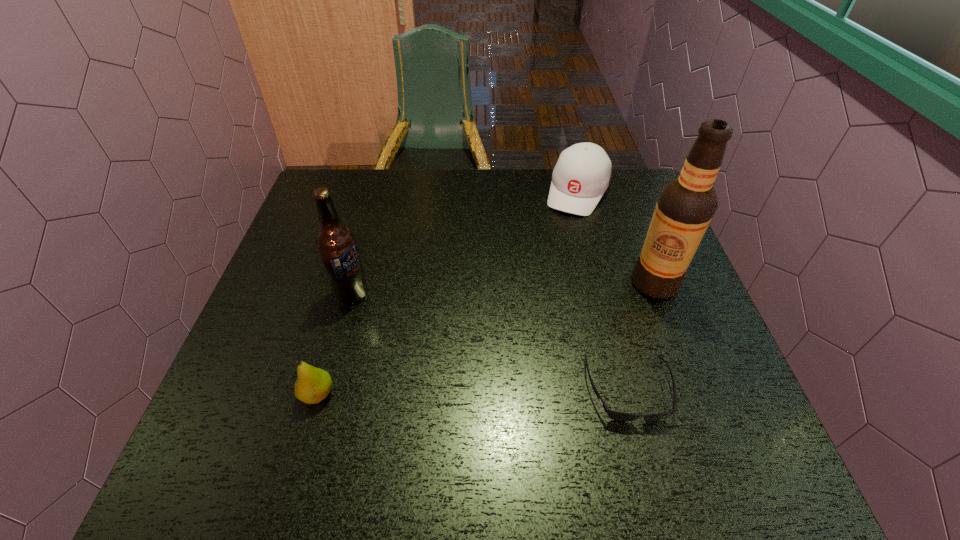
I want to click on pear, so click(313, 384).

Identify the location of sunglasses. (614, 415).

Locate an element on the screen. The width and height of the screenshot is (960, 540). the farthest object is located at coordinates (582, 174).

Where is `the tallest object`? the tallest object is located at coordinates (686, 205).

The height and width of the screenshot is (540, 960). Identify the location of beer bottle. (336, 243).

I want to click on vacant space situated on the back of the pear, so click(x=337, y=329).

Image resolution: width=960 pixels, height=540 pixels. What are the coordinates of `vacant space located on the front-facing side of the baseball cap` in the screenshot? It's located at (528, 305).

Image resolution: width=960 pixels, height=540 pixels. Identify the location of free region located 0.090m on the front-facing side of the baseball cap. (562, 234).

This screenshot has width=960, height=540. What are the coordinates of `free region located on the front-facing side of the baseball cap` in the screenshot? It's located at (526, 307).

You are a GUI agent. You are given a task and a screenshot of the screen. Output one action in this format:
    pyautogui.click(x=<x>, y=<y>)
    Task: Click on the free location located on the label of the alcohol
    Image resolution: width=960 pixels, height=540 pixels.
    Given the screenshot: What is the action you would take?
    pyautogui.click(x=547, y=343)